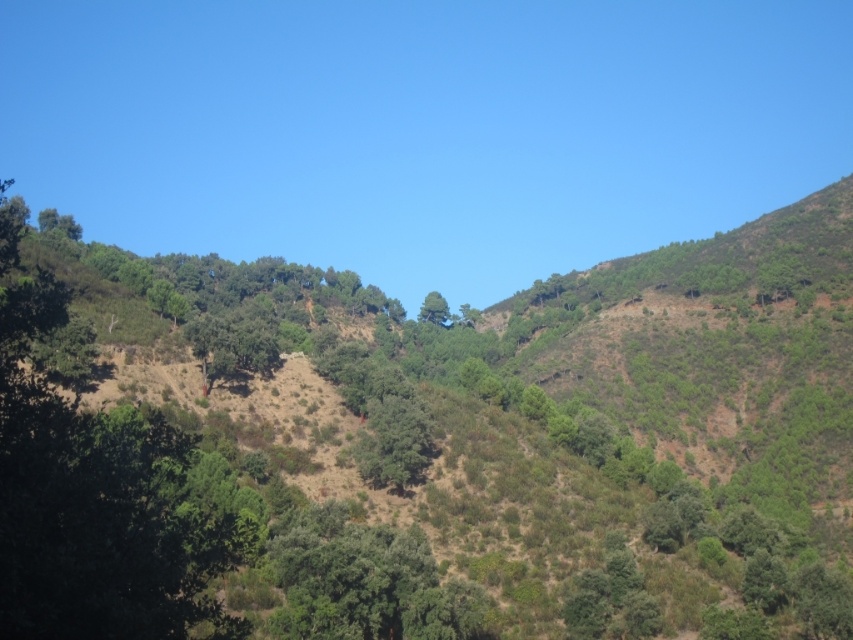
You are a hiker trying to navigate through the rolling hills. You see a green leafy tree at center and a green matte tree at center. Which tree is positioned lower in the landscape?

The green leafy tree at center is positioned lower than the green matte tree at center because it is described as being below it.